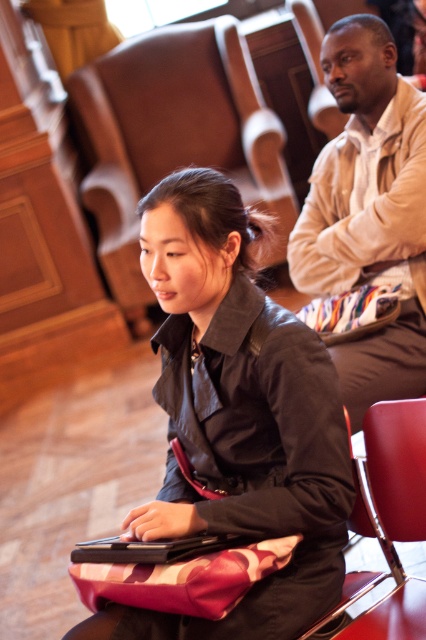
You are standing in the room and want to place a small decoration between the two points, point (305, 538) and point (253, 172). Considering their positions, which point should the decoration be closer to in order to appear larger from your perspective?

The decoration should be placed closer to point (305, 538) because it is closer to the camera, making objects placed there appear larger from your perspective.

You are arranging a small meeting in this room and need to place a rectangular table between the leather armchair at center and the smooth leather armchair at lower right. The table must be 1.2 meters wide. Can the table fit between them?

The leather armchair at center is wider than the smooth leather armchair at lower right. Since the table is 1.2 meters wide, we need to know the exact distance between the two chairs to determine if it fits. However, the provided information only states the relative widths of the chairs, not the space between them. Therefore, it is impossible to confirm if the table will fit based on the given details.

You are a service robot with a height of 1.6 meters. You need to move from the leather armchair at center to the light beige shirt at upper right. Can you pass through the space between them without bending down?

The distance between the leather armchair at center and light beige shirt at upper right is 2.17 meters. Since the robot is 1.6 meters tall, it can pass through the space without bending down as the height clearance is sufficient.